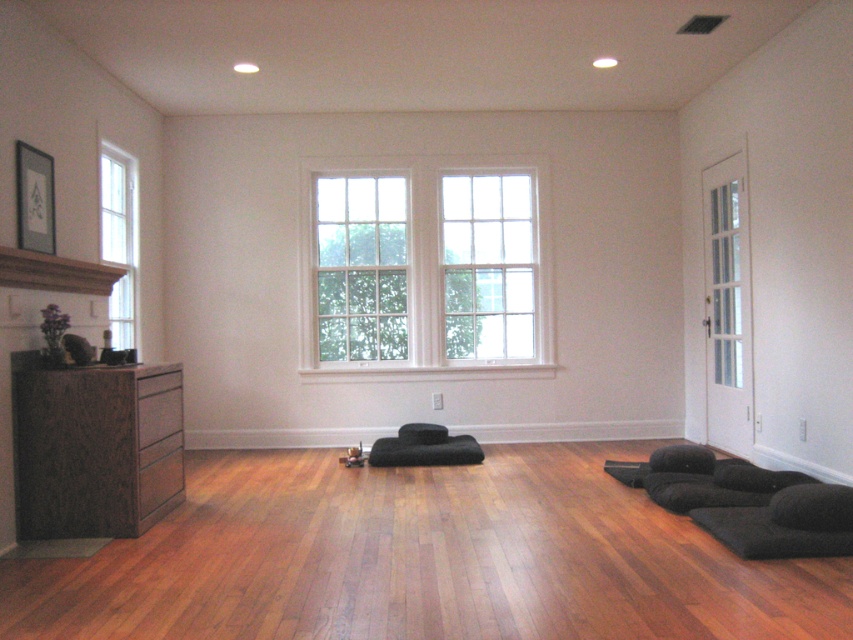
Is point (335, 269) closer to camera compared to point (61, 284)?

No, it is not.

Where is `white wooden window at center`? The height and width of the screenshot is (640, 853). white wooden window at center is located at coordinates (424, 266).

Can you confirm if clear glass window at center is positioned to the left of brown wood mantle at upper left?

In fact, clear glass window at center is to the right of brown wood mantle at upper left.

Is point (521, 314) positioned behind point (9, 253)?

Yes, it is.

Locate an element on the screen. clear glass window at center is located at coordinates (488, 266).

Who is positioned more to the right, white wooden window at center or clear glass window at center?

Positioned to the right is clear glass window at center.

Does white wooden window at center have a larger size compared to clear glass window at center?

Correct, white wooden window at center is larger in size than clear glass window at center.

Which is behind, point (376, 182) or point (496, 352)?

The point (496, 352) is more distant.

This screenshot has height=640, width=853. What are the coordinates of `white wooden window at center` in the screenshot? It's located at (424, 266).